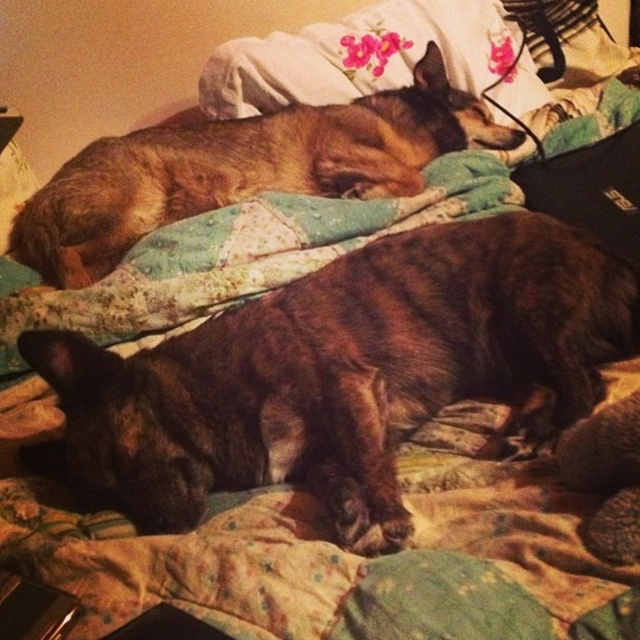
Who is taller, brown fur dog at center or fluffy quilt at center?

fluffy quilt at center is taller.

Where is `brown fur dog at center`? The image size is (640, 640). brown fur dog at center is located at coordinates (344, 371).

This screenshot has width=640, height=640. In order to click on brown fur dog at center in this screenshot , I will do `click(344, 371)`.

Find the location of a particular element. brown fur dog at center is located at coordinates (344, 371).

Is point (163, 404) behind point (465, 10)?

No, it is in front of (465, 10).

In the scene shown: Does brown fur dog at center have a lesser height compared to fluffy white pillow at upper center?

No.

The image size is (640, 640). In order to click on brown fur dog at center in this screenshot , I will do `click(344, 371)`.

Who is higher up, brown fur dog at upper left or fluffy white pillow at upper center?

fluffy white pillow at upper center

Which is in front, point (419, 76) or point (211, 65)?

Point (211, 65)

Who is more forward, (413, 113) or (412, 8)?

Point (413, 113)

The height and width of the screenshot is (640, 640). Find the location of `brown fur dog at upper left`. brown fur dog at upper left is located at coordinates (244, 168).